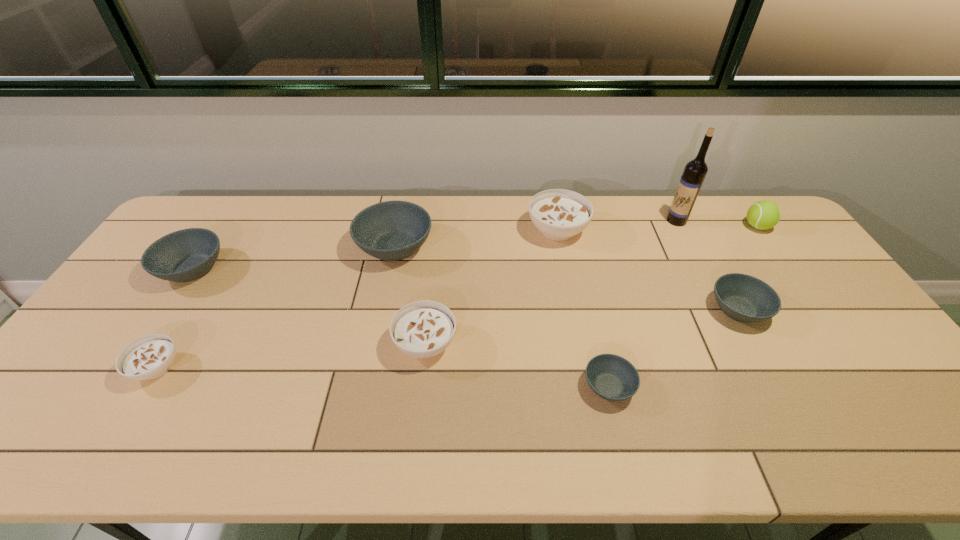
Where is `the tallest object`? The width and height of the screenshot is (960, 540). the tallest object is located at coordinates (694, 173).

Identify the location of wine bottle. (694, 173).

Where is `the farthest white soup bowl`? the farthest white soup bowl is located at coordinates (560, 214).

Find the location of `the biggest white soup bowl`. the biggest white soup bowl is located at coordinates (560, 214).

In order to click on green tennis ball in this screenshot , I will do `click(762, 215)`.

Identify the location of the rightmost object. This screenshot has height=540, width=960. (762, 215).

Locate an element on the screen. This screenshot has width=960, height=540. the biggest gray soup bowl is located at coordinates (392, 230).

This screenshot has width=960, height=540. I want to click on the third smallest gray soup bowl, so click(185, 255).

Image resolution: width=960 pixels, height=540 pixels. I want to click on the second biggest white soup bowl, so click(422, 329).

This screenshot has height=540, width=960. In order to click on the rightmost gray soup bowl in this screenshot , I will do `click(744, 298)`.